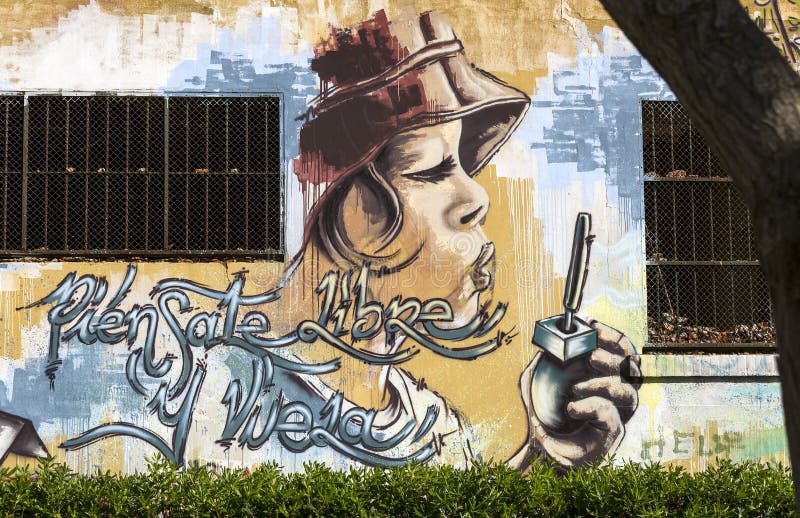
The width and height of the screenshot is (800, 518). I want to click on window, so click(170, 198), click(697, 258).